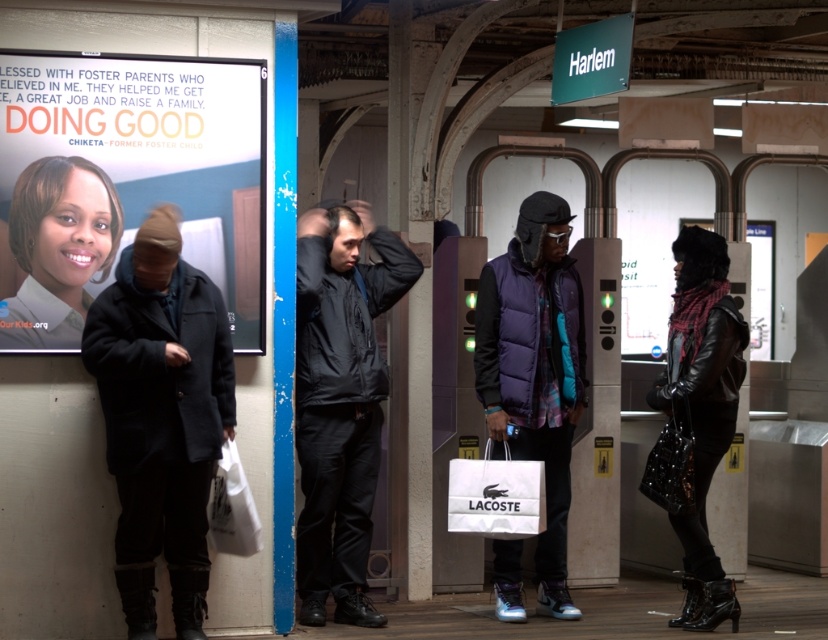
Based on the photo, does black matte jacket at center appear on the left side of leather jacket at right?

Yes, black matte jacket at center is to the left of leather jacket at right.

Who is lower down, black matte jacket at center or leather jacket at right?

leather jacket at right is lower down.

Based on the photo, who is more forward, (299, 260) or (720, 321)?

Positioned in front is point (720, 321).

Find the location of a particular element. The width and height of the screenshot is (828, 640). black matte jacket at center is located at coordinates (340, 401).

Is point (157, 502) less distant than point (222, 504)?

Yes, point (157, 502) is closer to viewer.

Does black wool coat at left have a greater height compared to white paper bag at lower left?

Indeed, black wool coat at left has a greater height compared to white paper bag at lower left.

Is point (147, 406) in front of point (253, 552)?

Yes, point (147, 406) is in front of point (253, 552).

Identify the location of black wool coat at left. [x=161, y=417].

Is matte black poster at upper left shorter than black matte jacket at center?

Indeed, matte black poster at upper left has a lesser height compared to black matte jacket at center.

Between point (147, 179) and point (400, 282), which one is positioned behind?

The point (400, 282) is more distant.

Is point (230, 140) behind point (360, 323)?

No, (230, 140) is in front of (360, 323).

I want to click on matte black poster at upper left, so click(155, 150).